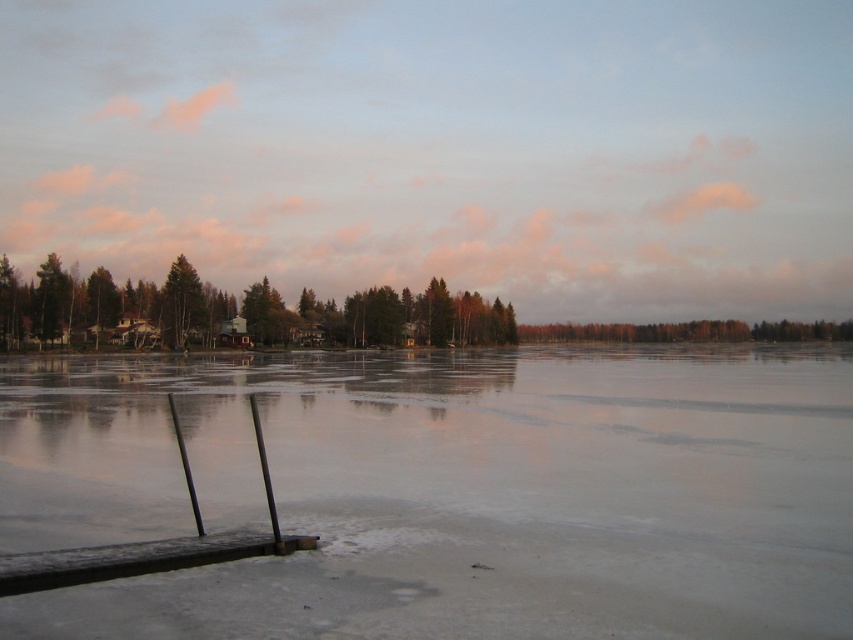
Describe the element at coordinates (447, 492) in the screenshot. I see `transparent ice at center` at that location.

Can you confirm if transparent ice at center is taller than brown wooden dock at lower left?

Incorrect, transparent ice at center's height is not larger of brown wooden dock at lower left's.

Which is behind, point (834, 385) or point (258, 416)?

Point (834, 385)

The height and width of the screenshot is (640, 853). Find the location of `transparent ice at center`. transparent ice at center is located at coordinates (447, 492).

Is brown wooden dock at lower left thinner than green matte tree at center?

Yes.

Does brown wooden dock at lower left have a lesser height compared to green matte tree at center?

Indeed, brown wooden dock at lower left has a lesser height compared to green matte tree at center.

Who is more forward, (90, 561) or (178, 339)?

Point (90, 561) is in front.

At what (x,y) coordinates should I click in order to perform the action: click on brown wooden dock at lower left. Please return your answer as a coordinate pair (x, y). Looking at the image, I should click on (152, 541).

Between transparent ice at center and green matte tree at center, which one is positioned lower?

transparent ice at center is below.

Based on the photo, does transparent ice at center appear on the right side of green matte tree at center?

Indeed, transparent ice at center is positioned on the right side of green matte tree at center.

The width and height of the screenshot is (853, 640). Describe the element at coordinates (447, 492) in the screenshot. I see `transparent ice at center` at that location.

I want to click on transparent ice at center, so click(x=447, y=492).